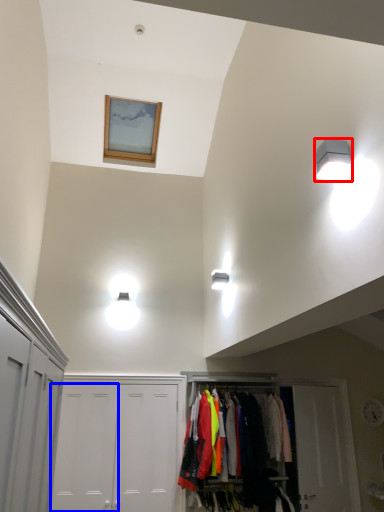
Question: Among these objects, which one is farthest to the camera, light fixture (highlighted by a red box) or door (highlighted by a blue box)?

Choices:
 (A) light fixture
 (B) door

Answer: (B)